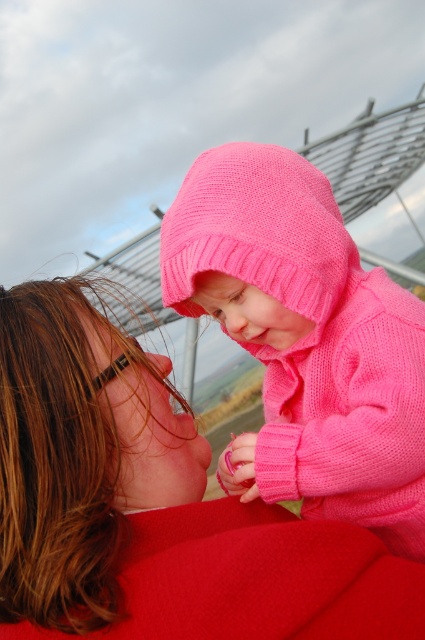
You are a fashion designer observing the image and need to select the larger sweater between the matte pink sweater at upper center and the knitted pink sweater at center. Which one should you choose?

The knitted pink sweater at center is larger than the matte pink sweater at upper center, so you should choose the knitted pink sweater at center.

You are standing in the scene and notice the matte pink sweater at upper center. Can you determine its exact location using the coordinate system provided?

The matte pink sweater at upper center is located at point (153, 506).

You are an observer looking at the scene. There are two pink sweaters in the image. The first is a matte pink sweater at upper center, and the second is a knitted pink sweater at center. Which one is positioned to the left of the other?

The matte pink sweater at upper center is to the left of the knitted pink sweater at center.